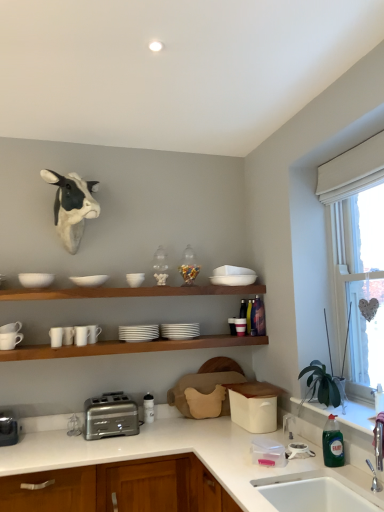
Question: Is brushed metal toaster at lower left, the 1th appliance positioned from the left, next to white ceramic sink at lower right, the 2th sink when ordered from top to bottom, and touching it?

Choices:
 (A) yes
 (B) no

Answer: (B)

Question: Is white ceramic sink at lower right, the 2th sink when ordered from top to bottom, completely or partially inside brushed metal toaster at lower left, the 1th appliance positioned from the left?

Choices:
 (A) no
 (B) yes

Answer: (A)

Question: From a real-world perspective, is brushed metal toaster at lower left, the 1th appliance positioned from the left, positioned under white ceramic sink at lower right, the 2th sink when ordered from top to bottom, based on gravity?

Choices:
 (A) no
 (B) yes

Answer: (A)

Question: Does brushed metal toaster at lower left, the second appliance viewed from the right, have a lesser height compared to white ceramic sink at lower right, the 2th sink when ordered from top to bottom?

Choices:
 (A) yes
 (B) no

Answer: (A)

Question: Is brushed metal toaster at lower left, the second appliance viewed from the right, at the right side of white ceramic sink at lower right, which appears as the first sink when ordered from the bottom?

Choices:
 (A) no
 (B) yes

Answer: (A)

Question: Considering the relative positions of brushed metal toaster at lower left, the 1th appliance positioned from the left, and white ceramic sink at lower right, the 2th sink when ordered from top to bottom, in the image provided, is brushed metal toaster at lower left, the 1th appliance positioned from the left, to the left of white ceramic sink at lower right, the 2th sink when ordered from top to bottom, from the viewer's perspective?

Choices:
 (A) no
 (B) yes

Answer: (B)

Question: Can you see white matte cups at left, positioned as the 6th tableware in right-to-left order, touching white glossy countertop at lower center?

Choices:
 (A) no
 (B) yes

Answer: (A)

Question: Is white matte cups at left, positioned as the 6th tableware in right-to-left order, facing away from white glossy countertop at lower center?

Choices:
 (A) yes
 (B) no

Answer: (B)

Question: Is white matte cups at left, which is the third tableware from left to right, to the right of white glossy countertop at lower center from the viewer's perspective?

Choices:
 (A) no
 (B) yes

Answer: (A)

Question: Could you tell me if white matte cups at left, positioned as the 6th tableware in right-to-left order, is facing white glossy countertop at lower center?

Choices:
 (A) yes
 (B) no

Answer: (B)

Question: Is white matte cups at left, which is the third tableware from left to right, located outside white glossy countertop at lower center?

Choices:
 (A) no
 (B) yes

Answer: (B)

Question: Can you confirm if white matte cups at left, which is the third tableware from left to right, is thinner than white glossy countertop at lower center?

Choices:
 (A) yes
 (B) no

Answer: (A)

Question: From the image's perspective, is green glass bottle at lower right beneath white ceramic cups at center?

Choices:
 (A) no
 (B) yes

Answer: (B)